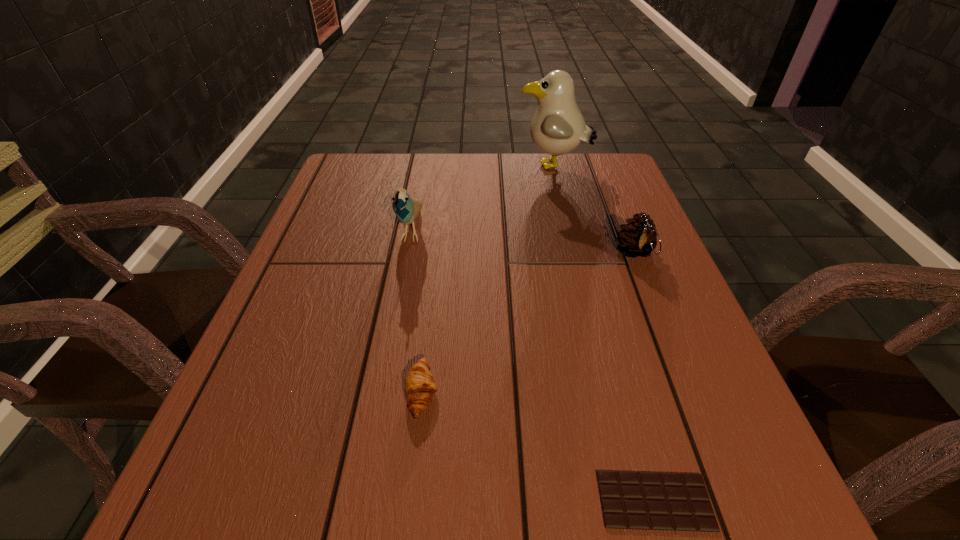
Where is `vacant area that lies between the third shortest object and the leftmost object`? The width and height of the screenshot is (960, 540). vacant area that lies between the third shortest object and the leftmost object is located at coordinates (523, 241).

This screenshot has height=540, width=960. What are the coordinates of `free point between the tallest object and the chocolate bar` in the screenshot? It's located at (604, 334).

Locate an element on the screen. This screenshot has height=540, width=960. free spot between the fourth object from right to left and the third shortest object is located at coordinates (528, 323).

Identify the location of free spot between the pinecone and the bird. The width and height of the screenshot is (960, 540). (523, 241).

Identify the location of vacant area that lies between the tallest object and the fourth tallest object. (488, 280).

I want to click on empty space that is in between the fourth shortest object and the second shortest object, so click(x=417, y=312).

The width and height of the screenshot is (960, 540). What are the coordinates of `free space that is in between the tallest object and the third tallest object` in the screenshot? It's located at (594, 210).

Identify the location of free space between the shortest object and the bird. (533, 365).

In order to click on free space between the pinecone and the tallest object in this screenshot , I will do `click(594, 210)`.

At what (x,y) coordinates should I click in order to perform the action: click on object identified as the fourth closest to the leftmost object. Please return your answer as a coordinate pair (x, y). The image size is (960, 540). Looking at the image, I should click on (630, 500).